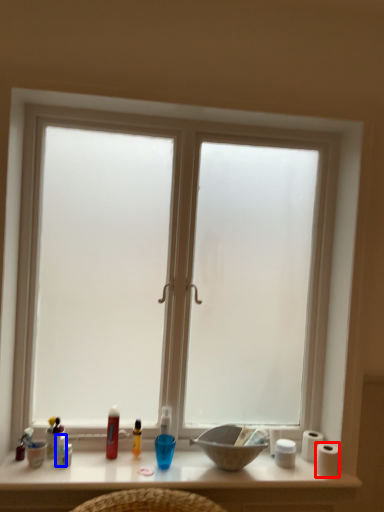
Question: Among these objects, which one is farthest to the camera, toilet paper (highlighted by a red box) or toiletry (highlighted by a blue box)?

Choices:
 (A) toilet paper
 (B) toiletry

Answer: (A)